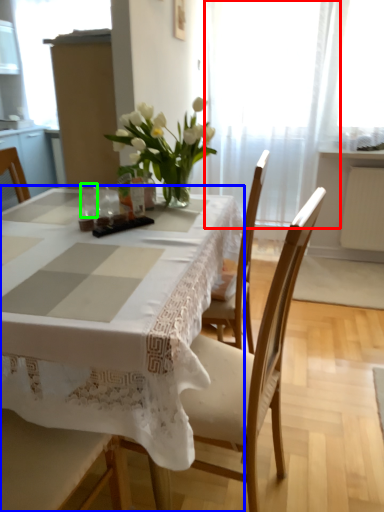
Question: Which object is the closest to the curtain (highlighted by a red box)? Choose among these: table (highlighted by a blue box) or tableware (highlighted by a green box).

Choices:
 (A) table
 (B) tableware

Answer: (B)